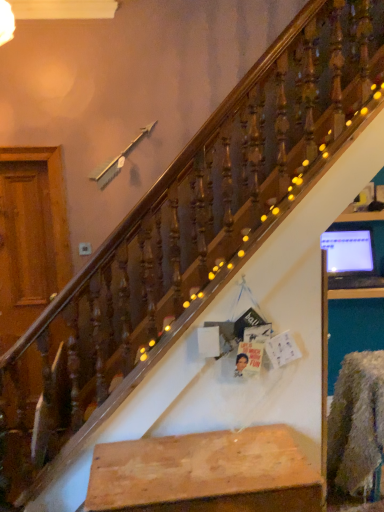
Where is `vacant area on top of wooden plank at center (from a real-world perspective)`? The width and height of the screenshot is (384, 512). vacant area on top of wooden plank at center (from a real-world perspective) is located at coordinates (196, 460).